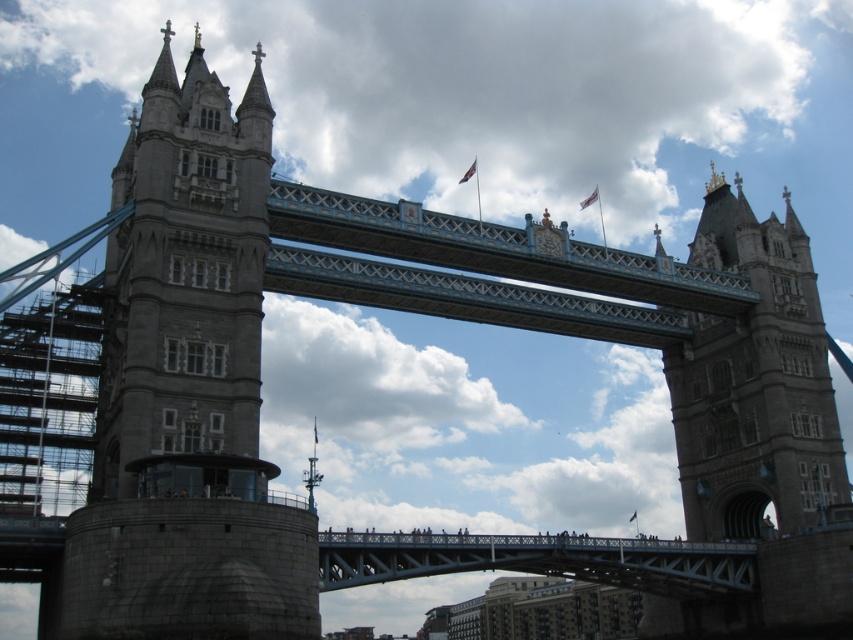
Is gray stone tower bridge at left to the left of white fluffy cloud at center from the viewer's perspective?

Correct, you'll find gray stone tower bridge at left to the left of white fluffy cloud at center.

Does point (230, 339) come in front of point (271, 358)?

Yes, it is in front of point (271, 358).

Locate an element on the screen. The width and height of the screenshot is (853, 640). gray stone tower bridge at left is located at coordinates (186, 390).

Who is lower down, white fluffy cloud at upper center or gray stone tower bridge at left?

gray stone tower bridge at left is below.

Who is taller, white fluffy cloud at upper center or gray stone tower bridge at left?

Standing taller between the two is gray stone tower bridge at left.

This screenshot has height=640, width=853. What do you see at coordinates (460, 104) in the screenshot?
I see `white fluffy cloud at upper center` at bounding box center [460, 104].

You are a GUI agent. You are given a task and a screenshot of the screen. Output one action in this format:
    pyautogui.click(x=<x>, y=<y>)
    Task: Click on the white fluffy cloud at upper center
    Image resolution: width=853 pixels, height=640 pixels.
    Given the screenshot: What is the action you would take?
    pyautogui.click(x=460, y=104)

Who is positioned more to the left, white fluffy cloud at upper center or white fluffy cloud at center?

white fluffy cloud at center is more to the left.

Can you confirm if white fluffy cloud at upper center is bigger than white fluffy cloud at center?

Indeed, white fluffy cloud at upper center has a larger size compared to white fluffy cloud at center.

Between point (432, 8) and point (267, 312), which one is positioned behind?

Point (432, 8)

Identify the location of white fluffy cloud at upper center. The width and height of the screenshot is (853, 640). [460, 104].